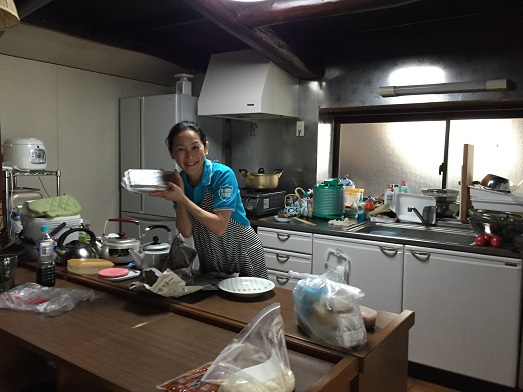
You are a GUI agent. You are given a task and a screenshot of the screen. Output one action in this format:
    pyautogui.click(x=<x>, y=<y>)
    Task: Click on the rice cooker
    The width and height of the screenshot is (523, 392).
    Given the screenshot: What is the action you would take?
    pyautogui.click(x=22, y=159)